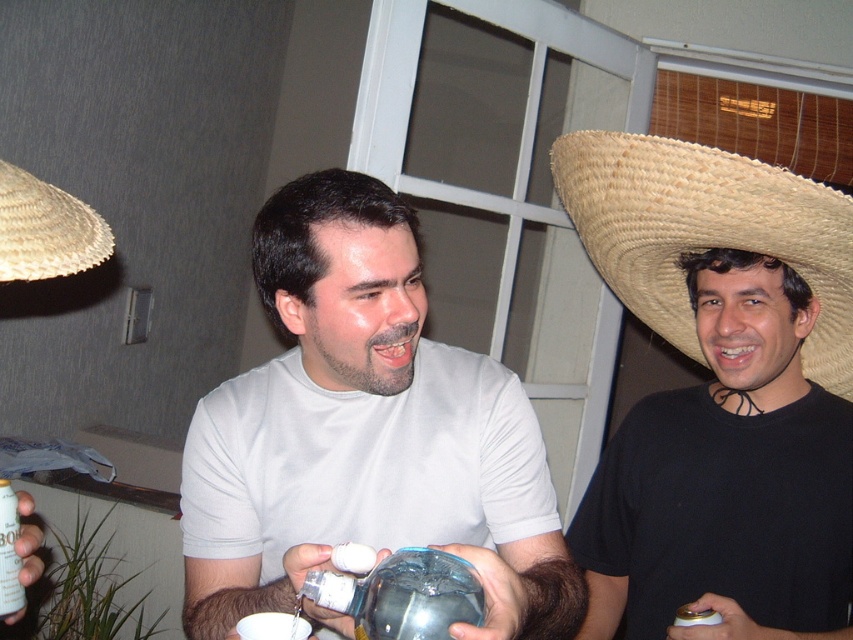
You are standing in the room where the gathering is happening. You want to hang a picture frame exactly at the point with coordinates point [706,232]. Where should you place the frame?

The point [706,232] corresponds to the straw woven sombrero at upper right, so you should place the frame at the position of the straw woven sombrero at upper right.

You are a photographer setting up for a group photo. You need to ensure that the straw woven sombrero at upper right and the metallic silver can at lower left are both in frame. Given that the camera has a fixed focal length, which object should you prioritize keeping centered to avoid cropping either one?

The straw woven sombrero at upper right should be prioritized as it is wider than the metallic silver can at lower left, so it requires more space in the frame.

Consider the image. You are standing in the room and want to place a small plant between the two points labeled as point (352, 246) and point (439, 628). Which point should the plant be closer to in order to be closer to the viewer?

The plant should be closer to point (352, 246) because it is further to the viewer than point (439, 628).